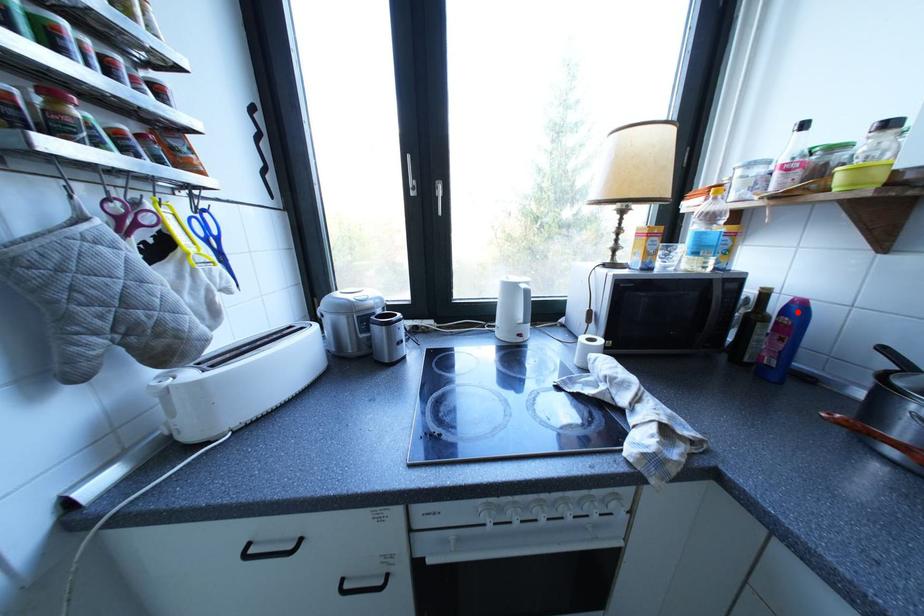
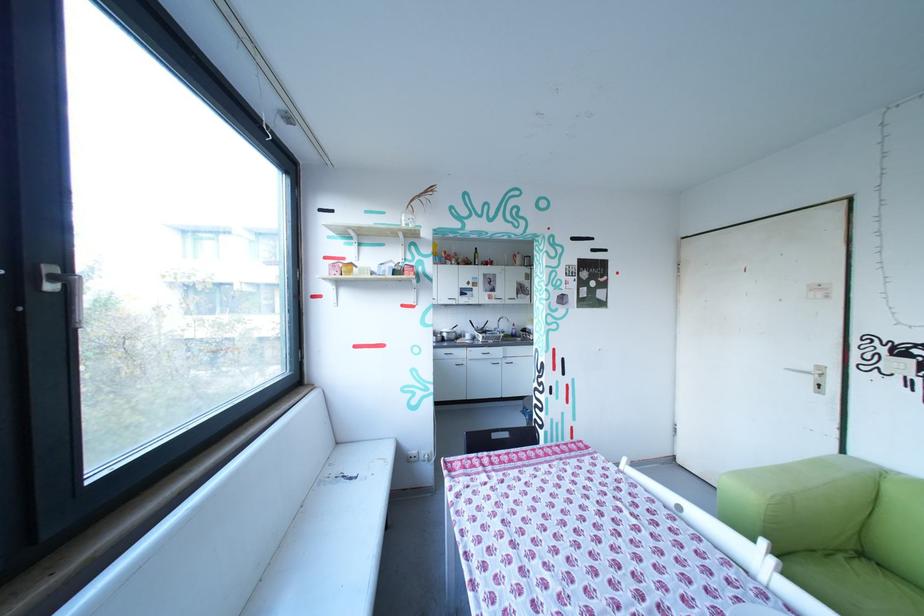
Question: I am providing you with two images of the same scene from different viewpoints. A red point is marked on the first image. At the location where the point appears in image 1, is it still visible in image 2?

Choices:
 (A) Yes
 (B) No

Answer: (B)